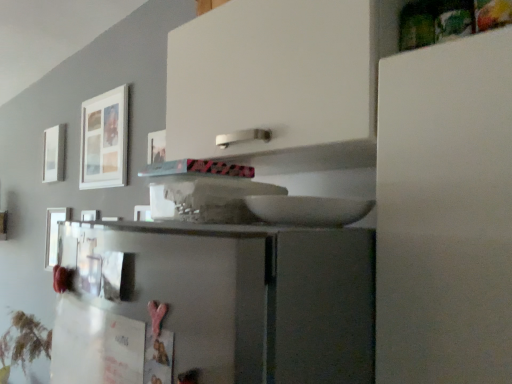
Question: Can you confirm if white matte picture frame at upper left, the first picture frame from the back, is thinner than white matte picture frame at upper left, which is the third picture frame in left-to-right order?

Choices:
 (A) yes
 (B) no

Answer: (B)

Question: From a real-world perspective, does white matte picture frame at upper left, arranged as the 3th picture frame when viewed from the right, sit lower than white matte picture frame at upper left, which is the first picture frame from front to back?

Choices:
 (A) yes
 (B) no

Answer: (A)

Question: Is white matte picture frame at upper left, the third picture frame from the back, at the back of white matte picture frame at upper left, the first picture frame from the back?

Choices:
 (A) no
 (B) yes

Answer: (A)

Question: Is white matte picture frame at upper left, the first picture frame from the back, shorter than white matte picture frame at upper left, which is the first picture frame from front to back?

Choices:
 (A) yes
 (B) no

Answer: (A)

Question: Considering the relative sizes of white matte picture frame at upper left, the first picture frame from the back, and white matte picture frame at upper left, which is the third picture frame in left-to-right order, in the image provided, is white matte picture frame at upper left, the first picture frame from the back, wider than white matte picture frame at upper left, which is the third picture frame in left-to-right order,?

Choices:
 (A) no
 (B) yes

Answer: (B)

Question: Looking at their shapes, would you say metallic silver picture frame at left, acting as the 2th picture frame starting from the left, is wider or thinner than white matte picture frame at upper left, which is the first picture frame from front to back?

Choices:
 (A) thin
 (B) wide

Answer: (B)

Question: Is point coord(56,240) closer or farther from the camera than point coord(117,165)?

Choices:
 (A) closer
 (B) farther

Answer: (A)

Question: Based on their positions, is metallic silver picture frame at left, the second picture frame in the right-to-left sequence, located to the left or right of white matte picture frame at upper left, which is the third picture frame in left-to-right order?

Choices:
 (A) left
 (B) right

Answer: (A)

Question: Do you think metallic silver picture frame at left, acting as the 2th picture frame starting from the left, is within white matte picture frame at upper left, the third picture frame from the back, or outside of it?

Choices:
 (A) inside
 (B) outside

Answer: (B)

Question: Considering the positions of white matte picture frame at upper left, which is the third picture frame in left-to-right order, and white matte picture frame at upper left, placed as the 1th picture frame when sorted from left to right, in the image, is white matte picture frame at upper left, which is the third picture frame in left-to-right order, wider or thinner than white matte picture frame at upper left, placed as the 1th picture frame when sorted from left to right,?

Choices:
 (A) wide
 (B) thin

Answer: (B)

Question: From their relative heights in the image, would you say white matte picture frame at upper left, which is the first picture frame from front to back, is taller or shorter than white matte picture frame at upper left, placed as the 1th picture frame when sorted from left to right?

Choices:
 (A) tall
 (B) short

Answer: (A)

Question: Would you say white matte picture frame at upper left, which is the third picture frame in left-to-right order, is to the left or to the right of white matte picture frame at upper left, placed as the 1th picture frame when sorted from left to right, in the picture?

Choices:
 (A) right
 (B) left

Answer: (A)

Question: From a real-world perspective, relative to white matte picture frame at upper left, the first picture frame from the back, is white matte picture frame at upper left, the third picture frame from the back, vertically above or below?

Choices:
 (A) above
 (B) below

Answer: (A)

Question: Is white matte picture frame at upper left, arranged as the 3th picture frame when viewed from the right, taller or shorter than metallic silver picture frame at left, which is counted as the second picture frame, starting from the back?

Choices:
 (A) short
 (B) tall

Answer: (A)

Question: Looking at the image, does white matte picture frame at upper left, arranged as the 3th picture frame when viewed from the right, seem bigger or smaller compared to metallic silver picture frame at left, the second picture frame positioned from the front?

Choices:
 (A) small
 (B) big

Answer: (B)